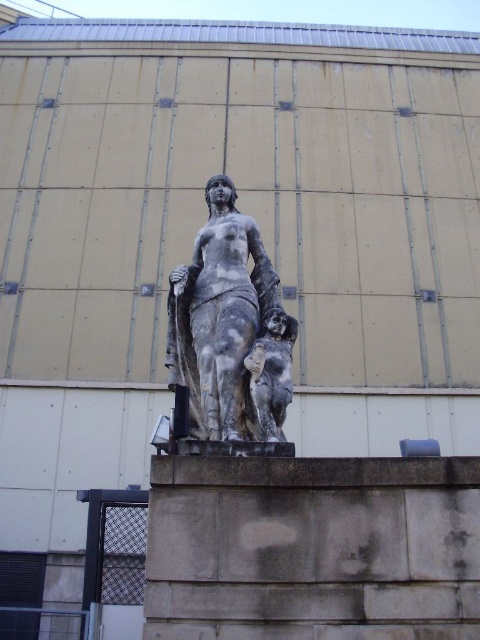
Which is behind, point (239, 438) or point (275, 419)?

The point (275, 419) is more distant.

At what (x,y) coordinates should I click in order to perform the action: click on marble statue at center. Please return your answer as a coordinate pair (x, y). The height and width of the screenshot is (640, 480). Looking at the image, I should click on (220, 317).